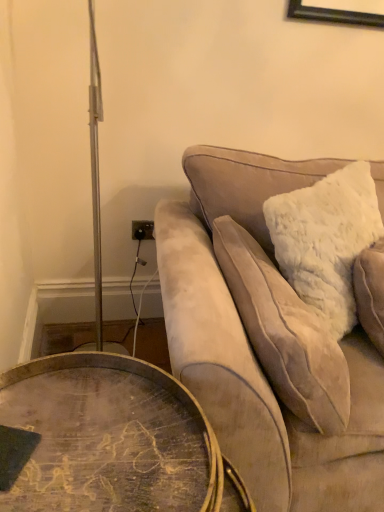
Question: From a real-world perspective, does wooden round table at lower left sit lower than white fluffy pillow at right?

Choices:
 (A) yes
 (B) no

Answer: (A)

Question: Considering the relative positions of wooden round table at lower left and white fluffy pillow at right in the image provided, is wooden round table at lower left to the right of white fluffy pillow at right from the viewer's perspective?

Choices:
 (A) yes
 (B) no

Answer: (B)

Question: Is wooden round table at lower left positioned beyond the bounds of white fluffy pillow at right?

Choices:
 (A) no
 (B) yes

Answer: (B)

Question: Considering the relative positions of wooden round table at lower left and white fluffy pillow at right in the image provided, is wooden round table at lower left behind white fluffy pillow at right?

Choices:
 (A) yes
 (B) no

Answer: (B)

Question: Could you tell me if wooden round table at lower left is turned towards white fluffy pillow at right?

Choices:
 (A) yes
 (B) no

Answer: (B)

Question: Does wooden round table at lower left have a lesser height compared to white fluffy pillow at right?

Choices:
 (A) yes
 (B) no

Answer: (B)

Question: Does white fluffy pillow at right turn towards wooden round table at lower left?

Choices:
 (A) no
 (B) yes

Answer: (A)

Question: Are white fluffy pillow at right and wooden round table at lower left far apart?

Choices:
 (A) yes
 (B) no

Answer: (B)

Question: Does white fluffy pillow at right touch wooden round table at lower left?

Choices:
 (A) no
 (B) yes

Answer: (A)

Question: Does white fluffy pillow at right have a greater height compared to wooden round table at lower left?

Choices:
 (A) no
 (B) yes

Answer: (A)

Question: Is white fluffy pillow at right shorter than wooden round table at lower left?

Choices:
 (A) yes
 (B) no

Answer: (A)

Question: From the image's perspective, does white fluffy pillow at right appear lower than wooden round table at lower left?

Choices:
 (A) no
 (B) yes

Answer: (A)

Question: Is wooden round table at lower left positioned with its back to velvet beige couch at upper right?

Choices:
 (A) yes
 (B) no

Answer: (B)